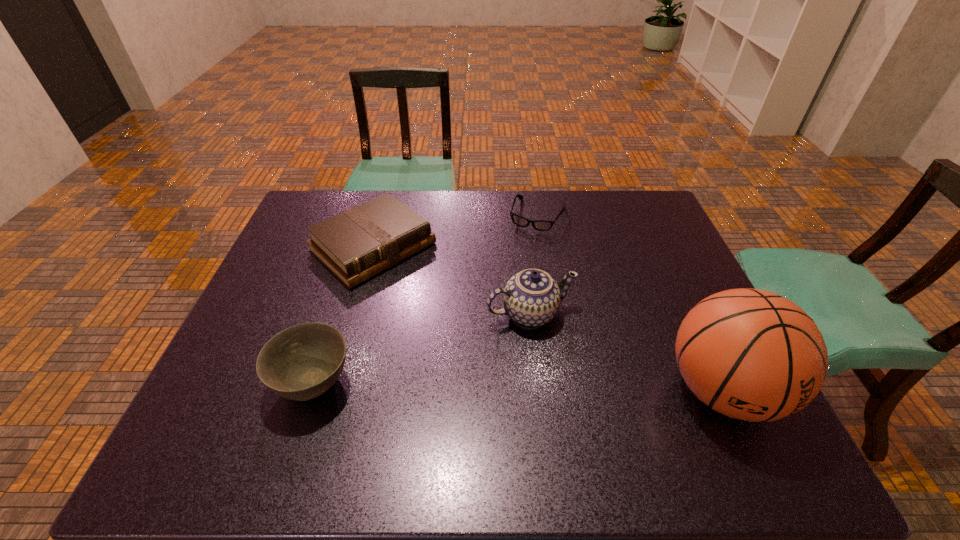
Find the location of a particular element. Image resolution: width=960 pixels, height=540 pixels. basketball that is at the near edge is located at coordinates (753, 355).

The height and width of the screenshot is (540, 960). I want to click on bowl at the left edge, so click(302, 362).

The height and width of the screenshot is (540, 960). I want to click on Bible present at the left edge, so click(359, 243).

What are the coordinates of `object present at the right edge` in the screenshot? It's located at (753, 355).

The width and height of the screenshot is (960, 540). Identify the location of object that is positioned at the far left corner. (359, 243).

This screenshot has height=540, width=960. In order to click on object present at the near left corner in this screenshot , I will do `click(302, 362)`.

The image size is (960, 540). Identify the location of object located in the near right corner section of the desktop. (753, 355).

The width and height of the screenshot is (960, 540). In order to click on vacant region at the far edge of the desktop in this screenshot , I will do `click(442, 190)`.

This screenshot has width=960, height=540. Identify the location of vacant space at the near edge of the desktop. (675, 401).

The height and width of the screenshot is (540, 960). In order to click on vacant region at the left edge of the desktop in this screenshot , I will do `click(317, 266)`.